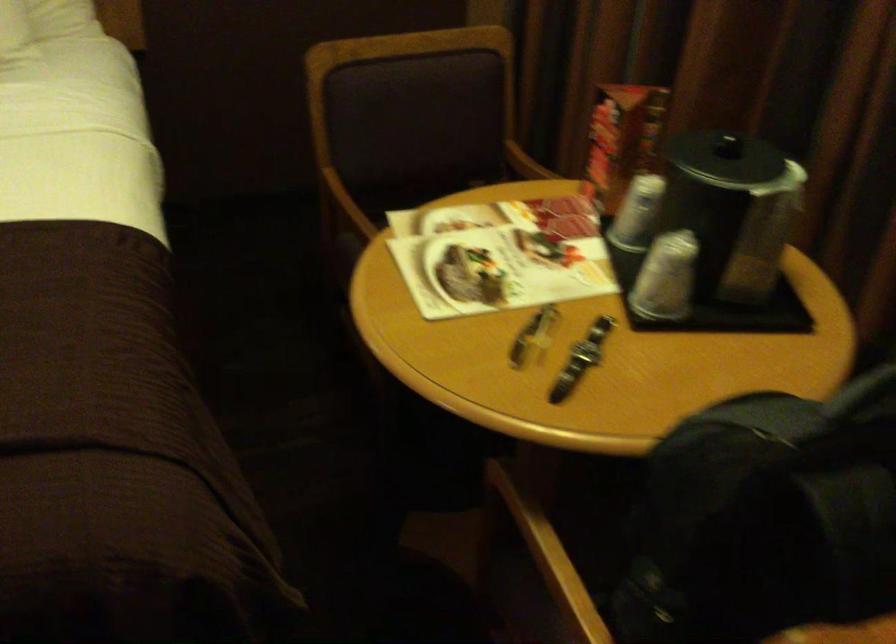
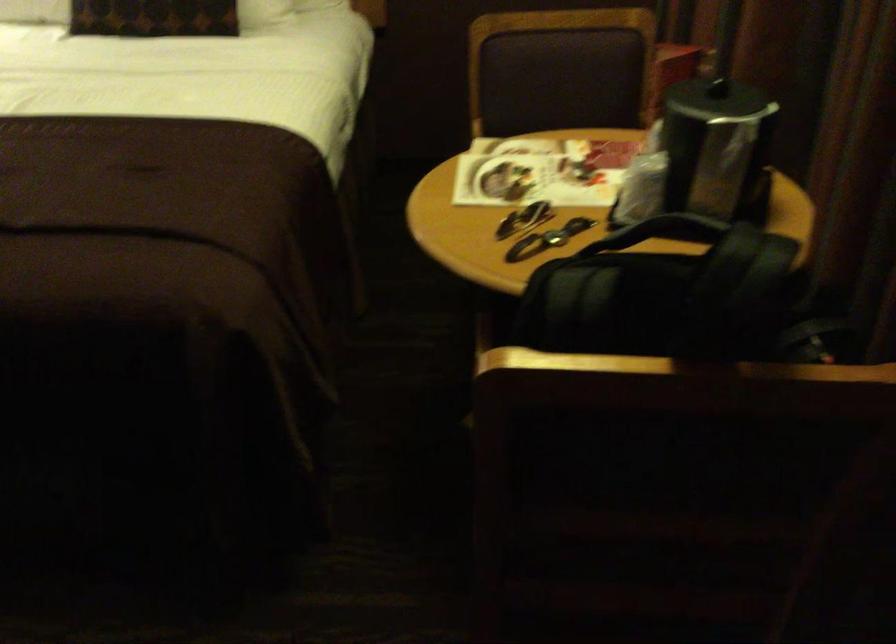
Question: I am providing you with two images of the same scene from different viewpoints. Please identify which objects are invisible in image2.

Choices:
 (A) chair sitting surface
 (B) backpack handle
 (C) steel coffee pot
 (D) none of these

Answer: (D)